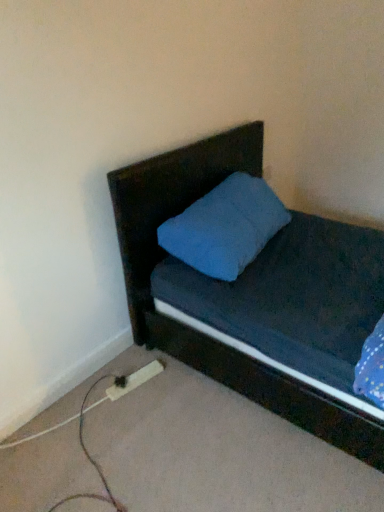
What is the approximate width of wooden extension cord at lower left?

It is 2.89 inches.

What do you see at coordinates (135, 380) in the screenshot?
I see `wooden extension cord at lower left` at bounding box center [135, 380].

Find the location of a particular element. This screenshot has width=384, height=512. wooden extension cord at lower left is located at coordinates (135, 380).

Identify the location of matte dark wood headboard at upper center. (171, 202).

The width and height of the screenshot is (384, 512). What do you see at coordinates (171, 202) in the screenshot?
I see `matte dark wood headboard at upper center` at bounding box center [171, 202].

Locate an element on the screen. Image resolution: width=384 pixels, height=512 pixels. wooden extension cord at lower left is located at coordinates coord(135,380).

Which object is positioned more to the right, wooden extension cord at lower left or matte dark wood headboard at upper center?

matte dark wood headboard at upper center.

Considering their positions, is wooden extension cord at lower left located in front of or behind matte dark wood headboard at upper center?

wooden extension cord at lower left is positioned farther from the viewer than matte dark wood headboard at upper center.

Between point (155, 367) and point (139, 185), which one is positioned in front?

Positioned in front is point (139, 185).

From the image's perspective, relative to matte dark wood headboard at upper center, is wooden extension cord at lower left above or below?

Clearly, from the image's perspective, wooden extension cord at lower left is below matte dark wood headboard at upper center.

From a real-world perspective, which is physically above, wooden extension cord at lower left or matte dark wood headboard at upper center?

From a 3D spatial view, matte dark wood headboard at upper center is above.

In the scene shown: In terms of width, does wooden extension cord at lower left look wider or thinner when compared to matte dark wood headboard at upper center?

Clearly, wooden extension cord at lower left has less width compared to matte dark wood headboard at upper center.

Who is taller, wooden extension cord at lower left or matte dark wood headboard at upper center?

matte dark wood headboard at upper center is taller.

Considering the sizes of objects wooden extension cord at lower left and matte dark wood headboard at upper center in the image provided, who is smaller, wooden extension cord at lower left or matte dark wood headboard at upper center?

Smaller between the two is wooden extension cord at lower left.

Would you say wooden extension cord at lower left is inside or outside matte dark wood headboard at upper center?

wooden extension cord at lower left cannot be found inside matte dark wood headboard at upper center.

Can you see wooden extension cord at lower left touching matte dark wood headboard at upper center?

wooden extension cord at lower left and matte dark wood headboard at upper center are not in contact.

Is wooden extension cord at lower left aimed at matte dark wood headboard at upper center?

No, wooden extension cord at lower left is not oriented towards matte dark wood headboard at upper center.

There is a wooden extension cord at lower left. Where is `headboard above it (from a real-world perspective)`? The height and width of the screenshot is (512, 384). headboard above it (from a real-world perspective) is located at coordinates (171, 202).

Considering the positions of objects matte dark wood headboard at upper center and wooden extension cord at lower left in the image provided, who is more to the left, matte dark wood headboard at upper center or wooden extension cord at lower left?

Positioned to the left is wooden extension cord at lower left.

Is the depth of matte dark wood headboard at upper center less than that of wooden extension cord at lower left?

Yes.

Is point (183, 168) behind point (107, 390)?

No, (183, 168) is closer to viewer.

From the image's perspective, which object appears higher, matte dark wood headboard at upper center or wooden extension cord at lower left?

matte dark wood headboard at upper center is shown above in the image.

From a real-world perspective, is matte dark wood headboard at upper center on wooden extension cord at lower left?

Yes, from a real-world perspective, matte dark wood headboard at upper center is on top of wooden extension cord at lower left.

Can you confirm if matte dark wood headboard at upper center is thinner than wooden extension cord at lower left?

Incorrect, the width of matte dark wood headboard at upper center is not less than that of wooden extension cord at lower left.

Is matte dark wood headboard at upper center taller than wooden extension cord at lower left?

Yes, matte dark wood headboard at upper center is taller than wooden extension cord at lower left.

Is matte dark wood headboard at upper center bigger than wooden extension cord at lower left?

Correct, matte dark wood headboard at upper center is larger in size than wooden extension cord at lower left.

Do you think matte dark wood headboard at upper center is within wooden extension cord at lower left, or outside of it?

matte dark wood headboard at upper center is located beyond the bounds of wooden extension cord at lower left.

Are matte dark wood headboard at upper center and wooden extension cord at lower left located far from each other?

No, there isn't a large distance between matte dark wood headboard at upper center and wooden extension cord at lower left.

Is matte dark wood headboard at upper center oriented towards wooden extension cord at lower left?

No, matte dark wood headboard at upper center does not turn towards wooden extension cord at lower left.

Can you tell me how much matte dark wood headboard at upper center and wooden extension cord at lower left differ in facing direction?

18.6 degrees.

Find the location of a particular element. This screenshot has width=384, height=512. extension cord below the matte dark wood headboard at upper center (from a real-world perspective) is located at coordinates (135, 380).

In the image, there is a matte dark wood headboard at upper center. Identify the location of extension cord below it (from a real-world perspective). (135, 380).

Locate an element on the screen. This screenshot has width=384, height=512. extension cord on the left of matte dark wood headboard at upper center is located at coordinates (135, 380).